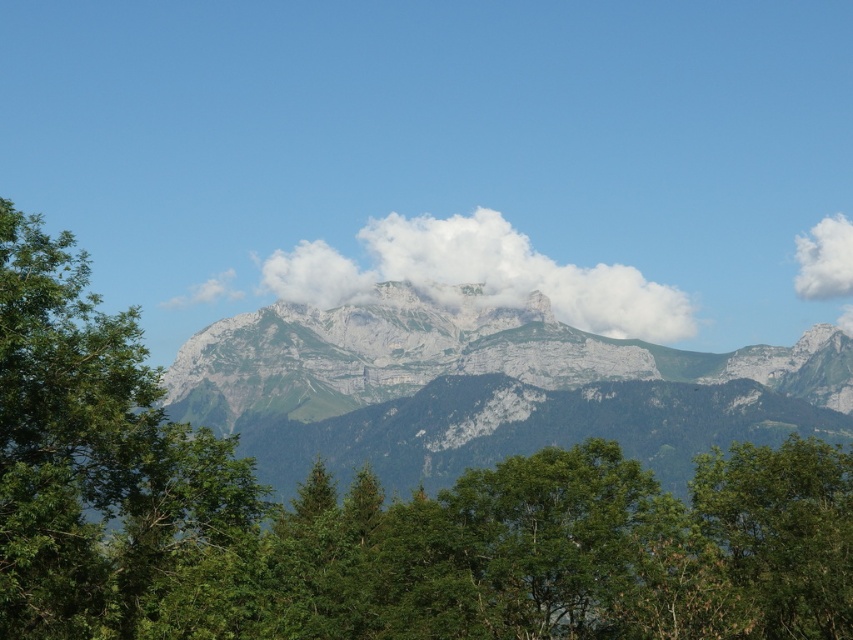
Question: Among these points, which one is nearest to the camera?

Choices:
 (A) (434, 278)
 (B) (579, 579)
 (C) (230, 353)

Answer: (B)

Question: Is white fluffy cloud at center to the left of white fluffy cloud at upper right from the viewer's perspective?

Choices:
 (A) yes
 (B) no

Answer: (A)

Question: Which point is farther to the camera?

Choices:
 (A) (496, 282)
 (B) (136, 449)

Answer: (A)

Question: Which of the following is the closest to the observer?

Choices:
 (A) (467, 394)
 (B) (793, 237)

Answer: (A)

Question: In this image, where is green leafy tree at center located relative to green leafy tree at left?

Choices:
 (A) left
 (B) right

Answer: (B)

Question: Does green leafy tree at center have a lesser width compared to white fluffy cloud at upper right?

Choices:
 (A) yes
 (B) no

Answer: (B)